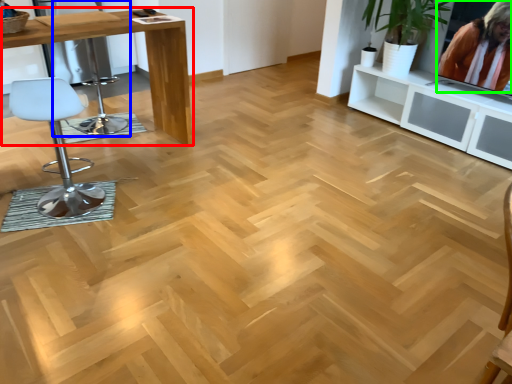
Question: Which is farther away from table (highlighted by a red box)? swivel chair (highlighted by a blue box) or person (highlighted by a green box)?

Choices:
 (A) swivel chair
 (B) person

Answer: (B)